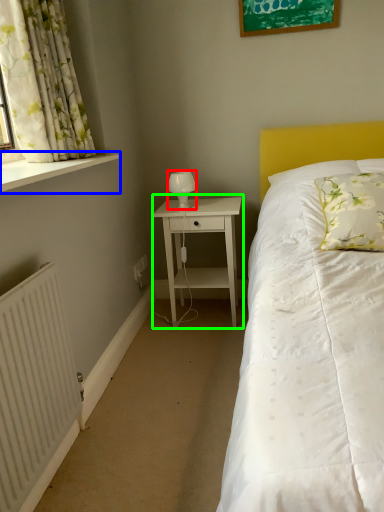
Question: Which is farther away from table lamp (highlighted by a red box)? window sill (highlighted by a blue box) or nightstand (highlighted by a green box)?

Choices:
 (A) window sill
 (B) nightstand

Answer: (A)